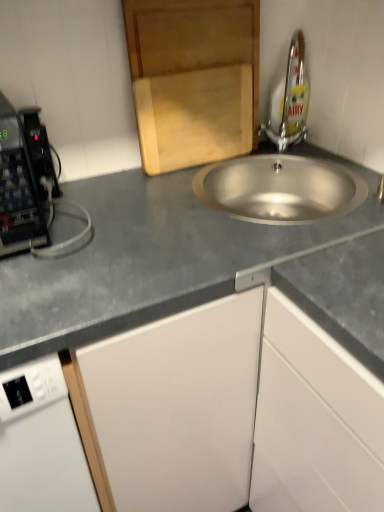
Question: Can you confirm if wooden cutting board at upper center, the 1th cabinetry positioned from the left, is wider than silver metallic tap at upper right?

Choices:
 (A) yes
 (B) no

Answer: (B)

Question: Is wooden cutting board at upper center, the 1th cabinetry positioned from the left, outside of silver metallic tap at upper right?

Choices:
 (A) no
 (B) yes

Answer: (B)

Question: Considering the relative sizes of wooden cutting board at upper center, the 1th cabinetry positioned from the top, and silver metallic tap at upper right in the image provided, is wooden cutting board at upper center, the 1th cabinetry positioned from the top, bigger than silver metallic tap at upper right?

Choices:
 (A) no
 (B) yes

Answer: (A)

Question: From the image's perspective, is wooden cutting board at upper center, the 1th cabinetry positioned from the left, beneath silver metallic tap at upper right?

Choices:
 (A) yes
 (B) no

Answer: (A)

Question: Considering the relative sizes of wooden cutting board at upper center, the 1th cabinetry positioned from the left, and silver metallic tap at upper right in the image provided, is wooden cutting board at upper center, the 1th cabinetry positioned from the left, taller than silver metallic tap at upper right?

Choices:
 (A) no
 (B) yes

Answer: (B)

Question: Based on their positions, is gray matte countertop at center located to the left or right of wooden cutting board at upper center, the 1th cabinetry positioned from the left?

Choices:
 (A) right
 (B) left

Answer: (A)

Question: Does point (8, 290) appear closer or farther from the camera than point (223, 69)?

Choices:
 (A) closer
 (B) farther

Answer: (A)

Question: Based on their sizes in the image, would you say gray matte countertop at center is bigger or smaller than wooden cutting board at upper center, which is the second cabinetry in bottom-to-top order?

Choices:
 (A) big
 (B) small

Answer: (A)

Question: Is gray matte countertop at center taller or shorter than wooden cutting board at upper center, the 1th cabinetry positioned from the left?

Choices:
 (A) tall
 (B) short

Answer: (A)

Question: From a real-world perspective, is gray matte countertop at center physically located above or below white matte cabinet at lower right, the 1th cabinetry from the right?

Choices:
 (A) below
 (B) above

Answer: (B)

Question: Is gray matte countertop at center in front of or behind white matte cabinet at lower right, which appears as the first cabinetry when ordered from the bottom, in the image?

Choices:
 (A) front
 (B) behind

Answer: (A)

Question: Considering the positions of point (175, 295) and point (311, 362), is point (175, 295) closer or farther from the camera than point (311, 362)?

Choices:
 (A) farther
 (B) closer

Answer: (B)

Question: Is gray matte countertop at center inside the boundaries of white matte cabinet at lower right, the second cabinetry viewed from the top, or outside?

Choices:
 (A) inside
 (B) outside

Answer: (B)

Question: In terms of width, does stainless steel sink at center look wider or thinner when compared to white matte cabinet at lower right, which appears as the first cabinetry when ordered from the bottom?

Choices:
 (A) thin
 (B) wide

Answer: (A)

Question: Is stainless steel sink at center taller or shorter than white matte cabinet at lower right, which appears as the first cabinetry when ordered from the bottom?

Choices:
 (A) tall
 (B) short

Answer: (B)